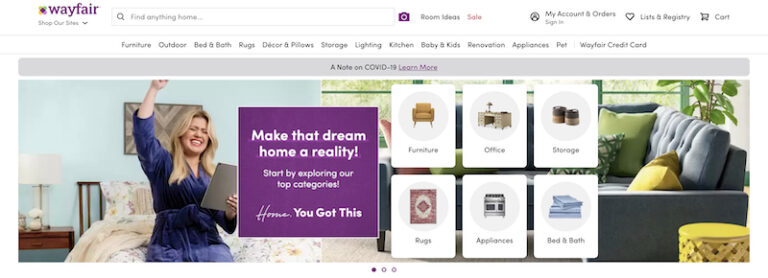
Where is `rugs link`? The image size is (768, 278). rugs link is located at coordinates (247, 47).